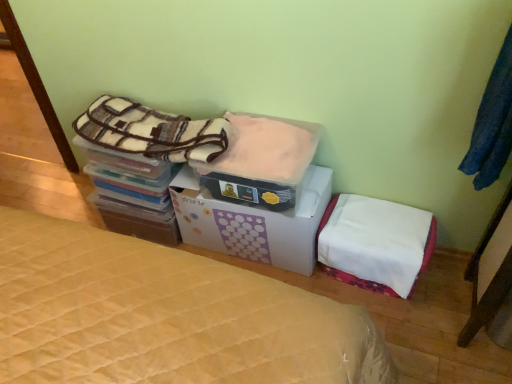
I want to click on free point above white fabric mattress at lower right (from a real-world perspective), so click(382, 223).